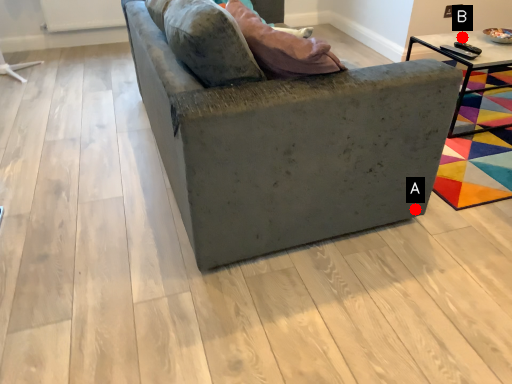
Question: Two points are circled on the image, labeled by A and B beside each circle. Which point is farther from the camera taking this photo?

Choices:
 (A) A is further
 (B) B is further

Answer: (B)